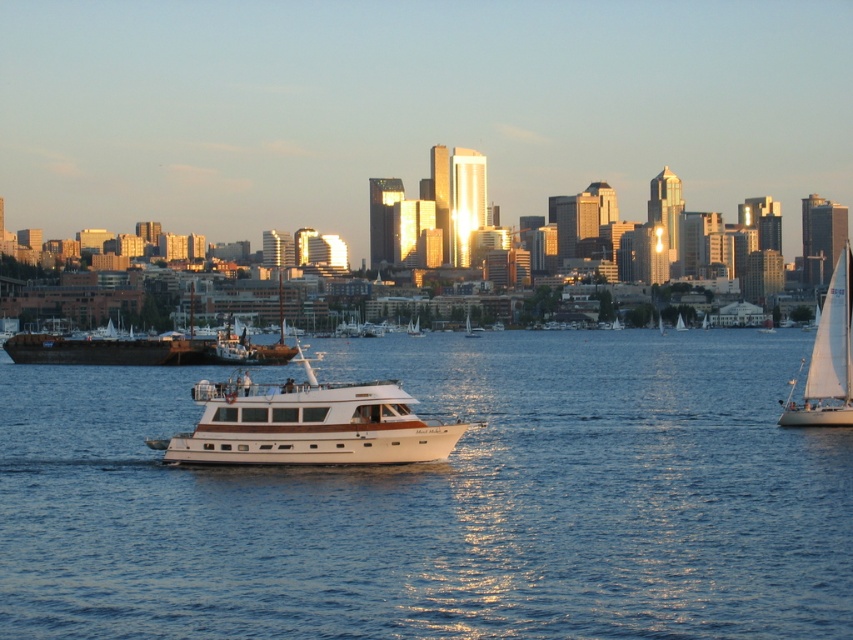
What is located at the coordinates point (440,500)?

The coordinates point (440,500) are occupied by blue water at center.

You are standing on the dock and see the blue water at center and the white sailboat at center. Which object is closer to you?

The blue water at center is closer to you because it is in front of the white sailboat at center.

You are standing on the dock and want to know the exact location of the blue water at center. According to the coordinates provided, where is it positioned?

The blue water at center is located at point 0.783 on the x axis and 0.518 on the y axis.